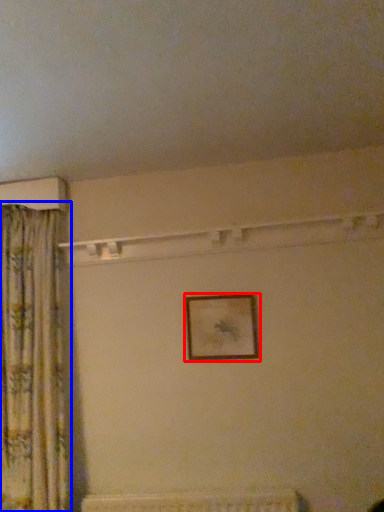
Question: Among these objects, which one is farthest to the camera, picture frame (highlighted by a red box) or curtain (highlighted by a blue box)?

Choices:
 (A) picture frame
 (B) curtain

Answer: (A)